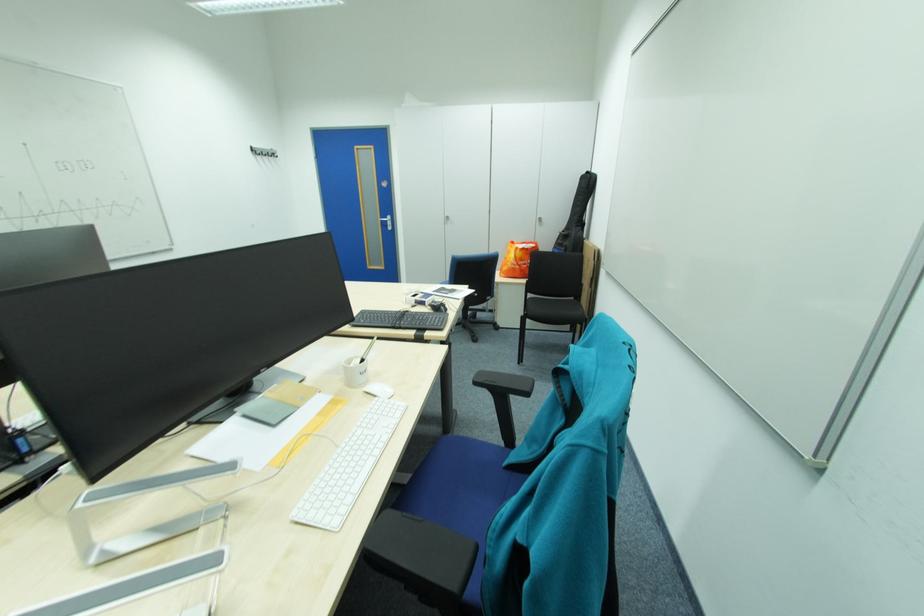
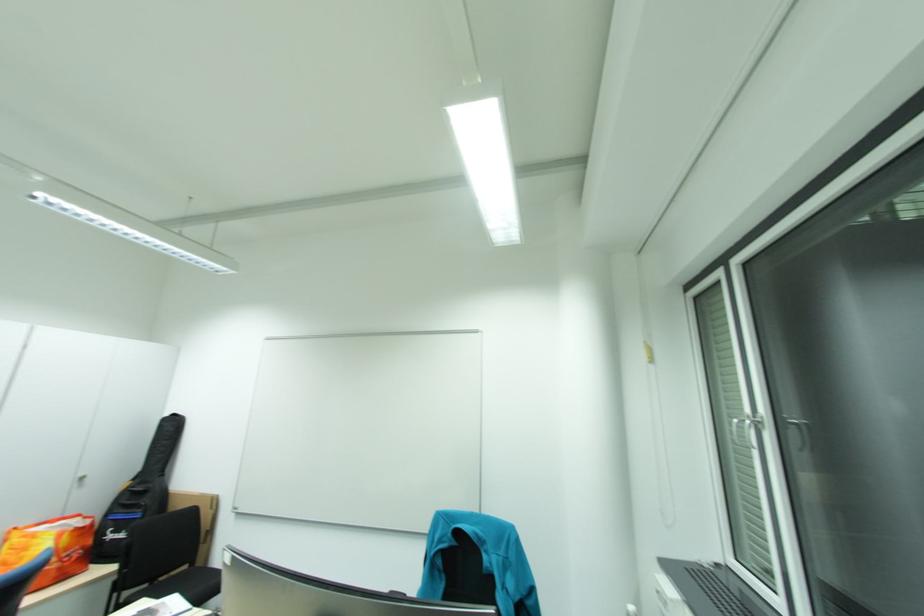
In the second image, find the point that corresponds to [546,220] in the first image.

(86, 480)